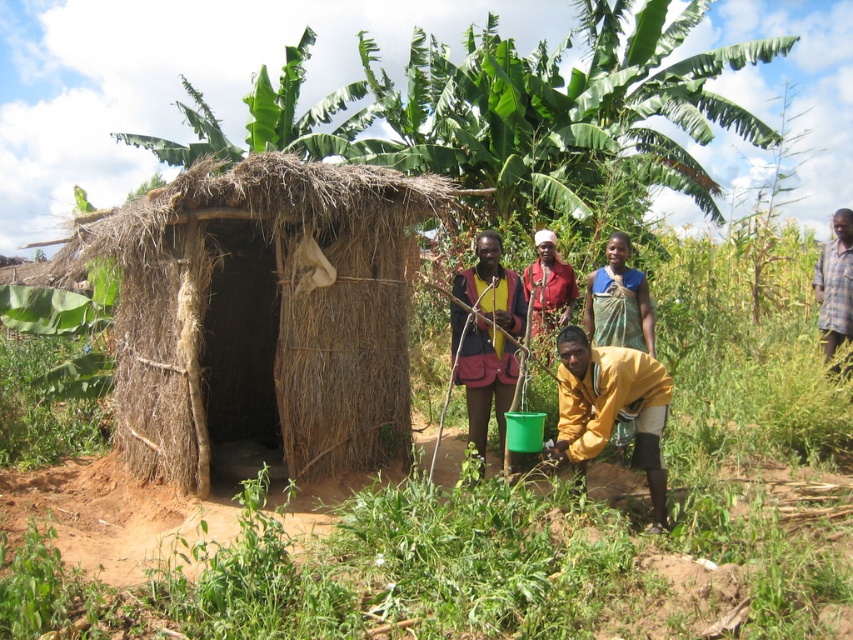
Question: Considering the real-world distances, which object is closest to the red fabric headscarf at center?

Choices:
 (A) yellow matte shirt at lower center
 (B) yellow fabric shirt at center
 (C) plaid shirt at right

Answer: (B)

Question: Among these points, which one is nearest to the camera?

Choices:
 (A) (117, 140)
 (B) (531, 301)

Answer: (B)

Question: Can you confirm if blue fabric sari at center is positioned below plaid shirt at right?

Choices:
 (A) yes
 (B) no

Answer: (A)

Question: Estimate the real-world distances between objects in this image. Which object is closer to the yellow matte shirt at lower center?

Choices:
 (A) plaid shirt at right
 (B) blue fabric sari at center
 (C) yellow fabric shirt at center
 (D) red fabric headscarf at center

Answer: (C)

Question: Is brown thatch hut at center bigger than green leafy banana tree at upper center?

Choices:
 (A) no
 (B) yes

Answer: (A)

Question: Does blue fabric sari at center lie behind plaid shirt at right?

Choices:
 (A) no
 (B) yes

Answer: (A)